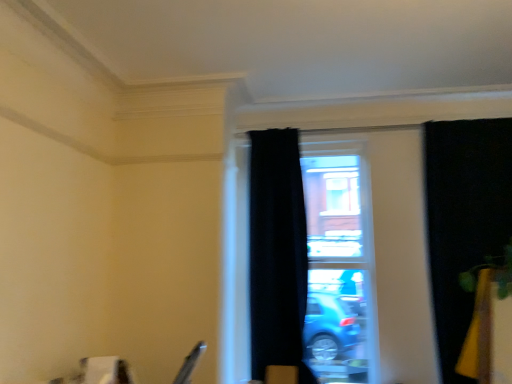
Question: Is transparent glass window at center thinner than black velvet curtain at right, which is the 2th curtain in left-to-right order?

Choices:
 (A) yes
 (B) no

Answer: (A)

Question: From a real-world perspective, is transparent glass window at center located beneath black velvet curtain at right, which is the 1th curtain in right-to-left order?

Choices:
 (A) yes
 (B) no

Answer: (A)

Question: Is black velvet curtain at right, which is the 2th curtain in left-to-right order, completely or partially inside transparent glass window at center?

Choices:
 (A) no
 (B) yes

Answer: (A)

Question: Is the position of transparent glass window at center more distant than that of black velvet curtain at right, which is the 2th curtain in left-to-right order?

Choices:
 (A) yes
 (B) no

Answer: (A)

Question: Does transparent glass window at center come in front of black velvet curtain at right, which is the 2th curtain in left-to-right order?

Choices:
 (A) yes
 (B) no

Answer: (B)

Question: From a real-world perspective, is transparent glass window at center on top of black velvet curtain at right, which is the 1th curtain in right-to-left order?

Choices:
 (A) no
 (B) yes

Answer: (A)

Question: Does black velvet curtain at right, which is the 2th curtain in left-to-right order, come in front of transparent glass window at center?

Choices:
 (A) no
 (B) yes

Answer: (B)

Question: Does black velvet curtain at right, which is the 2th curtain in left-to-right order, contain transparent glass window at center?

Choices:
 (A) yes
 (B) no

Answer: (B)

Question: Considering the relative positions of black velvet curtain at right, which is the 1th curtain in right-to-left order, and transparent glass window at center in the image provided, is black velvet curtain at right, which is the 1th curtain in right-to-left order, to the left of transparent glass window at center from the viewer's perspective?

Choices:
 (A) no
 (B) yes

Answer: (A)

Question: Is black velvet curtain at right, which is the 1th curtain in right-to-left order, not inside transparent glass window at center?

Choices:
 (A) yes
 (B) no

Answer: (A)

Question: From a real-world perspective, is black velvet curtain at right, which is the 1th curtain in right-to-left order, under transparent glass window at center?

Choices:
 (A) no
 (B) yes

Answer: (A)

Question: Are black velvet curtain at right, which is the 1th curtain in right-to-left order, and transparent glass window at center making contact?

Choices:
 (A) yes
 (B) no

Answer: (B)

Question: Does black velvet curtain at right, which is the 1th curtain in right-to-left order, have a greater width compared to black velvet curtain at center, which is the 2th curtain in right-to-left order?

Choices:
 (A) no
 (B) yes

Answer: (A)